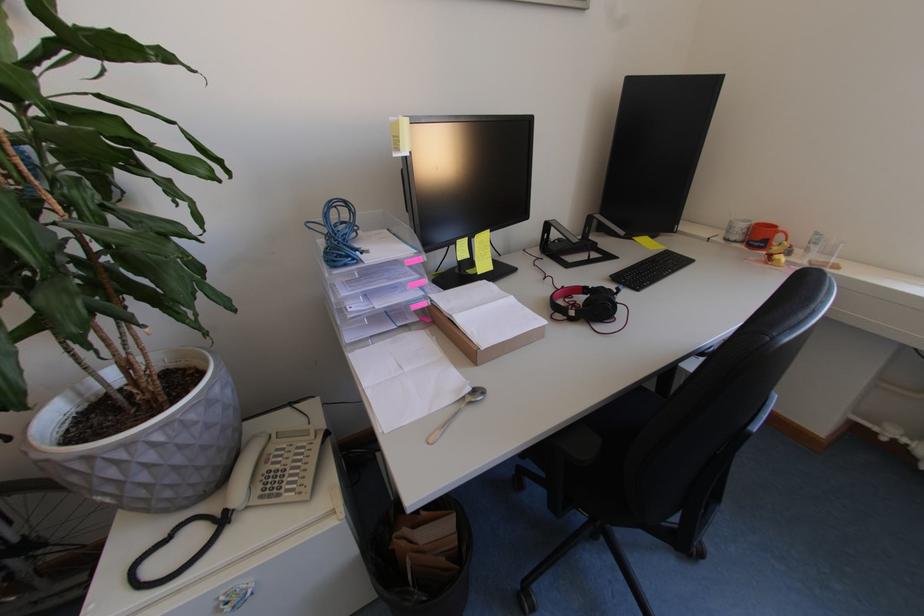
What do you see at coordinates (781, 236) in the screenshot?
I see `the orange mug handle` at bounding box center [781, 236].